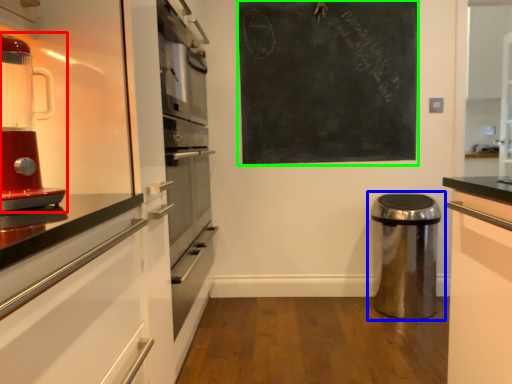
Question: Which is farther away from home appliance (highlighted by a red box)? waste container (highlighted by a blue box) or bulletin board (highlighted by a green box)?

Choices:
 (A) waste container
 (B) bulletin board

Answer: (A)